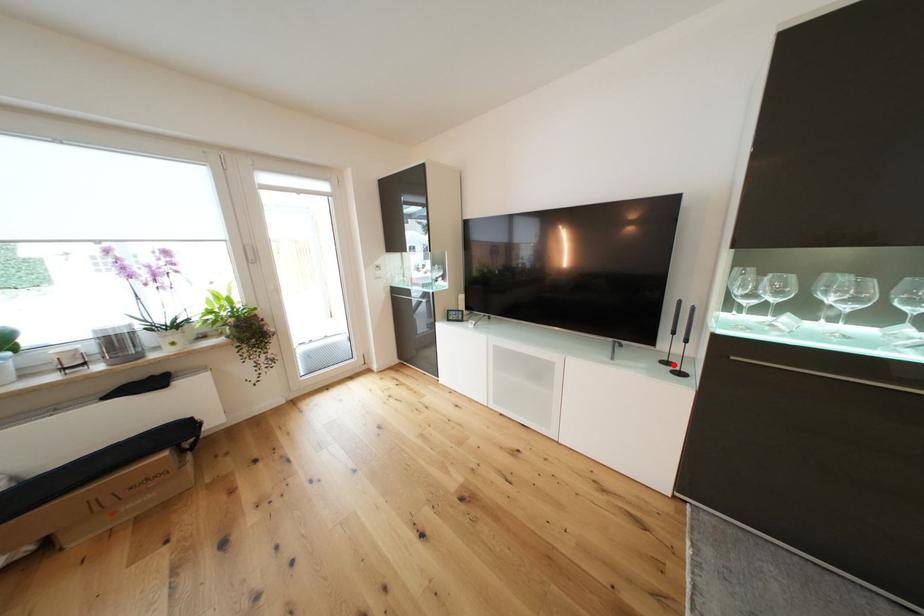
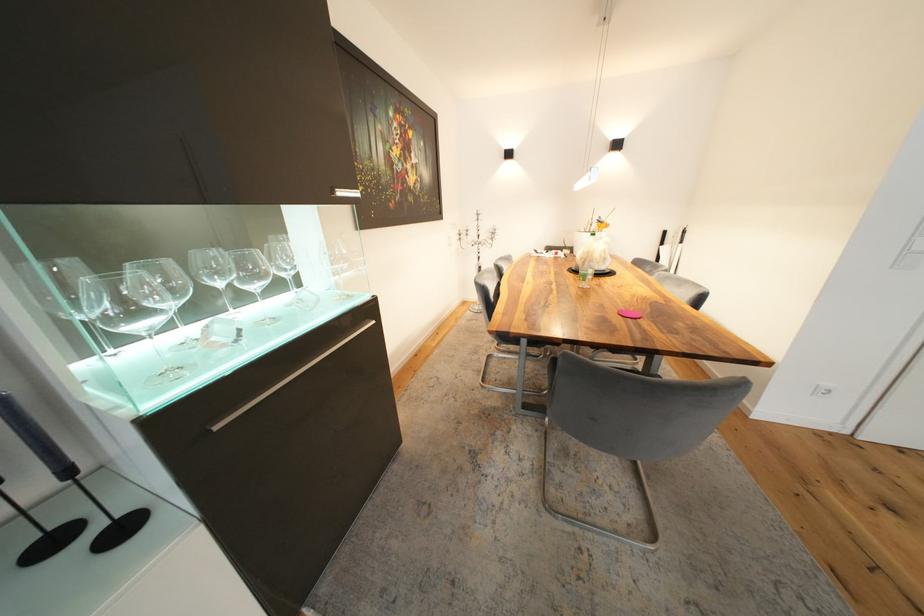
Question: I am providing you with two images of the same scene from different viewpoints. A red point is marked on the first image. At the location where the point appears in image 1, is it still visible in image 2?

Choices:
 (A) Yes
 (B) No

Answer: (A)